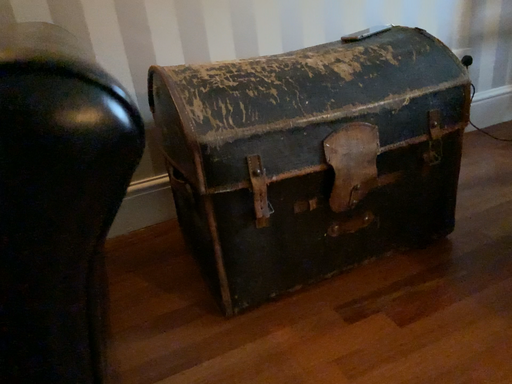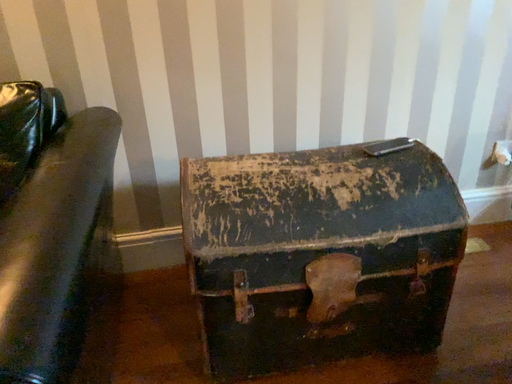
Question: How did the camera likely rotate when shooting the video?

Choices:
 (A) rotated left
 (B) rotated right

Answer: (A)